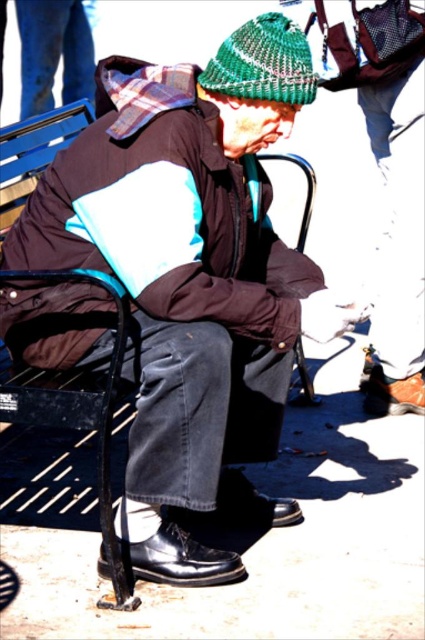
You are a fashion designer observing a person wearing a brown matte jacket at center and a green knitted hat at upper center. Which item of clothing do you think has a bigger size?

The brown matte jacket at center is larger in size than the green knitted hat at upper center.

You are a fashion designer observing a person wearing a brown matte jacket at center and a green knitted hat at upper center. Which item is closer to you based on their positions?

The brown matte jacket at center is closer to you because it is in front of the green knitted hat at upper center.

You are a tailor who needs to determine if the brown matte jacket at center can fit into a storage box designed for the green knitted hat at upper center. Based on their sizes, will the jacket fit?

The brown matte jacket at center might be wider than green knitted hat at upper center, so it may not fit into the storage box designed for the hat.